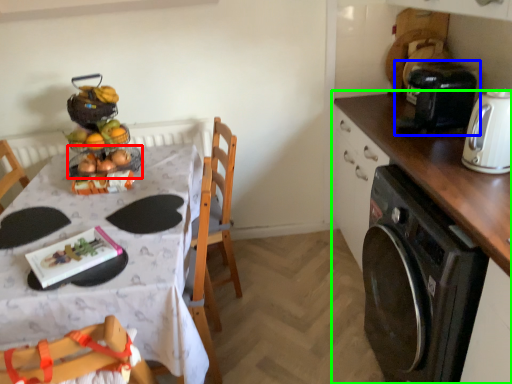
Question: Which is nearer to the basket (highlighted by a red box)? coffee machine (highlighted by a blue box) or cabinetry (highlighted by a green box).

Choices:
 (A) coffee machine
 (B) cabinetry

Answer: (B)